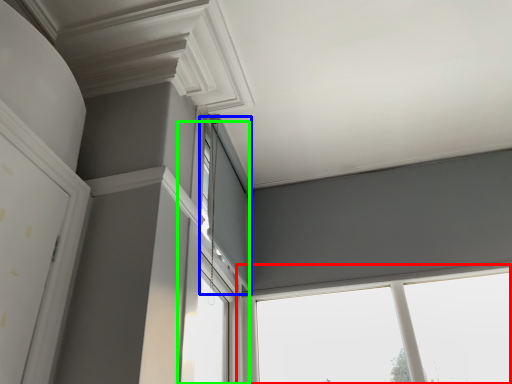
Question: Which object is the farthest from window (highlighted by a red box)? Choose among these: window (highlighted by a blue box) or window (highlighted by a green box).

Choices:
 (A) window
 (B) window

Answer: (A)